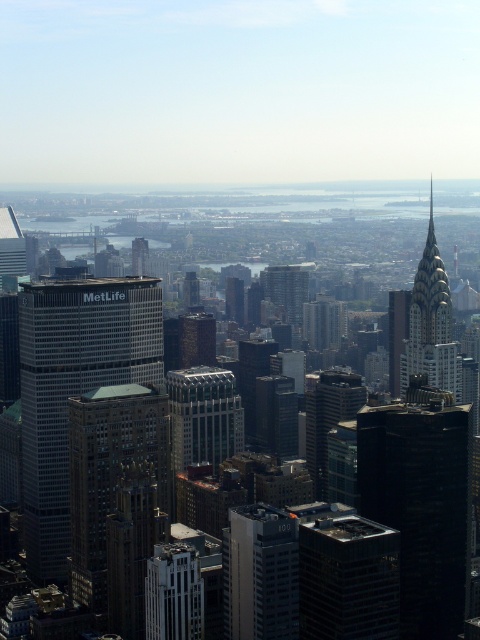
You are standing at the point marked by point (74,387) in the cityscape. What type of building are you in front of?

The point (74,387) marks a brown brick building at center.

You are a city planner assessing the skyline for potential solar panel installations. You observe the white glass building at center and the white marble skyscraper at center. Which of these two structures has a larger footprint on the ground based on their widths?

The white glass building at center might be wider than white marble skyscraper at center, so it likely has a larger footprint for solar panels.